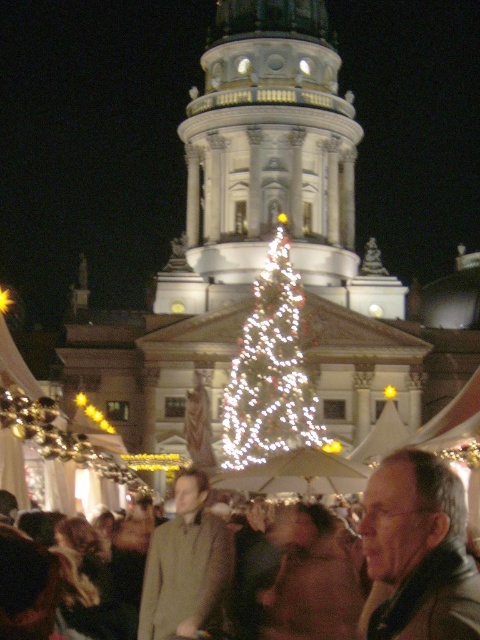
Question: Which point is closer to the camera?

Choices:
 (A) (274, 342)
 (B) (169, 602)
 (C) (423, 476)

Answer: (C)

Question: Which point is farther from the camera taking this photo?

Choices:
 (A) (465, 605)
 (B) (153, 634)
 (C) (186, 109)
 (D) (303, 371)

Answer: (C)

Question: Is white marble tower at center to the left of light brown leather jacket at lower right from the viewer's perspective?

Choices:
 (A) no
 (B) yes

Answer: (B)

Question: Considering the relative positions of light brown leather jacket at lower right and green wool coat at center in the image provided, where is light brown leather jacket at lower right located with respect to green wool coat at center?

Choices:
 (A) above
 (B) below

Answer: (A)

Question: Does white marble tower at center appear under illuminated glass christmas tree at center?

Choices:
 (A) yes
 (B) no

Answer: (B)

Question: Which point is closer to the camera?

Choices:
 (A) (396, 564)
 (B) (331, 68)
 (C) (279, 388)

Answer: (A)